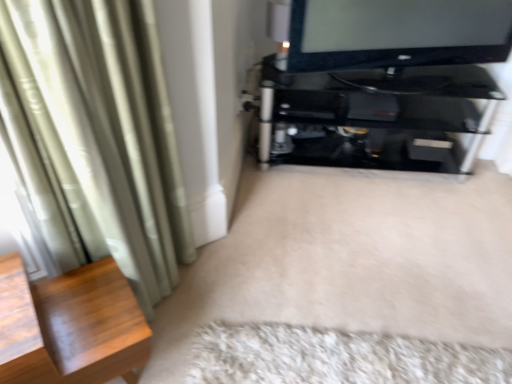
Question: From the image's perspective, is black glossy television at upper right under white fluffy rug at lower center?

Choices:
 (A) yes
 (B) no

Answer: (B)

Question: Can you confirm if black glossy television at upper right is smaller than white fluffy rug at lower center?

Choices:
 (A) no
 (B) yes

Answer: (A)

Question: Considering the relative sizes of black glossy television at upper right and white fluffy rug at lower center in the image provided, is black glossy television at upper right taller than white fluffy rug at lower center?

Choices:
 (A) no
 (B) yes

Answer: (B)

Question: Can you confirm if black glossy television at upper right is thinner than white fluffy rug at lower center?

Choices:
 (A) yes
 (B) no

Answer: (A)

Question: From a real-world perspective, does black glossy television at upper right stand above white fluffy rug at lower center?

Choices:
 (A) yes
 (B) no

Answer: (A)

Question: Considering the positions of silky green curtain at left and wooden side table at left in the image, is silky green curtain at left wider or thinner than wooden side table at left?

Choices:
 (A) wide
 (B) thin

Answer: (B)

Question: From the image's perspective, is silky green curtain at left above or below wooden side table at left?

Choices:
 (A) above
 (B) below

Answer: (A)

Question: Is silky green curtain at left taller or shorter than wooden side table at left?

Choices:
 (A) tall
 (B) short

Answer: (A)

Question: Is silky green curtain at left to the left or to the right of wooden side table at left in the image?

Choices:
 (A) left
 (B) right

Answer: (B)

Question: In the image, is wooden side table at left on the left side or the right side of black glossy television at upper right?

Choices:
 (A) right
 (B) left

Answer: (B)

Question: Is point (54, 344) closer or farther from the camera than point (373, 11)?

Choices:
 (A) farther
 (B) closer

Answer: (B)

Question: Is wooden side table at left inside the boundaries of black glossy television at upper right, or outside?

Choices:
 (A) inside
 (B) outside

Answer: (B)

Question: Is wooden side table at left wider or thinner than black glossy television at upper right?

Choices:
 (A) thin
 (B) wide

Answer: (B)

Question: In the image, is black glossy television at upper right on the left side or the right side of silky green curtain at left?

Choices:
 (A) left
 (B) right

Answer: (B)

Question: In terms of height, does black glossy television at upper right look taller or shorter compared to silky green curtain at left?

Choices:
 (A) short
 (B) tall

Answer: (A)